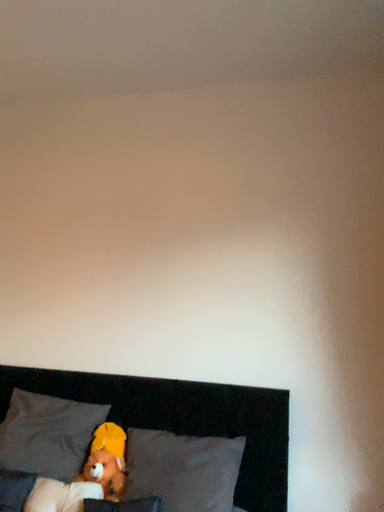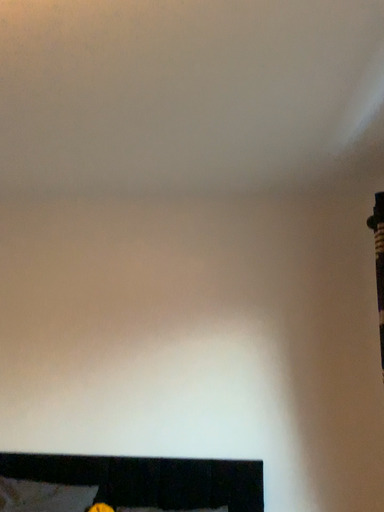
Question: How did the camera likely rotate when shooting the video?

Choices:
 (A) rotated downward
 (B) rotated upward

Answer: (B)